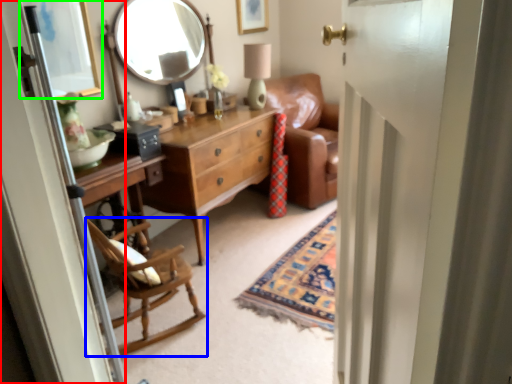
Question: Considering the real-world distances, which object is farthest from screen door (highlighted by a red box)? chair (highlighted by a blue box) or picture frame (highlighted by a green box)?

Choices:
 (A) chair
 (B) picture frame

Answer: (B)